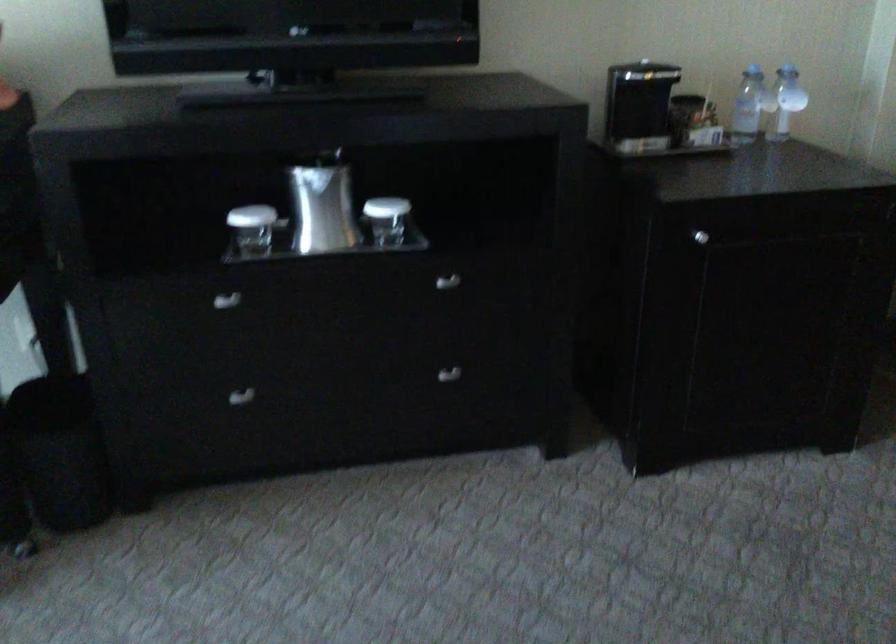
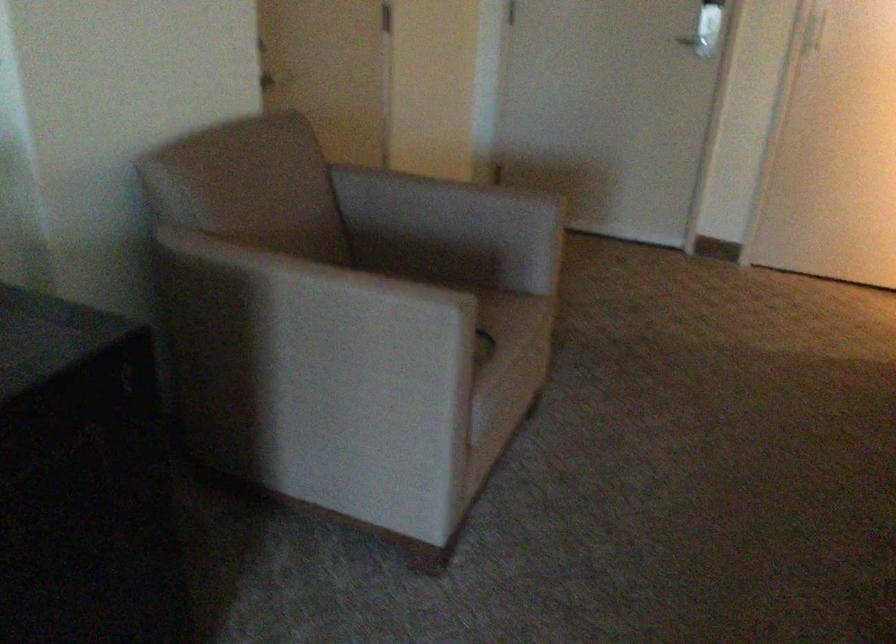
Question: The camera is either moving clockwise (left) or counter-clockwise (right) around the object. The first image is from the beginning of the video and the second image is from the end. Is the camera moving left or right when shooting the video?

Choices:
 (A) Left
 (B) Right

Answer: (A)